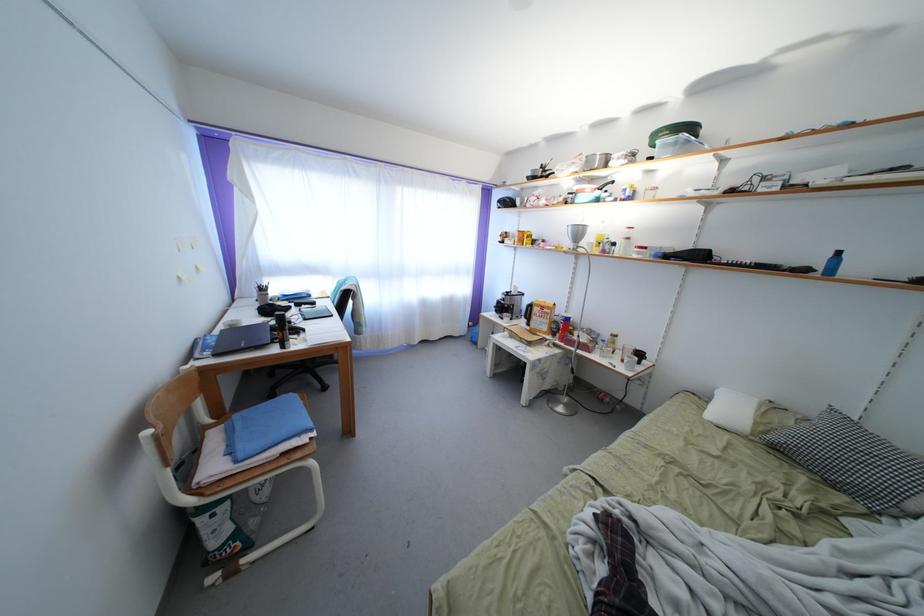
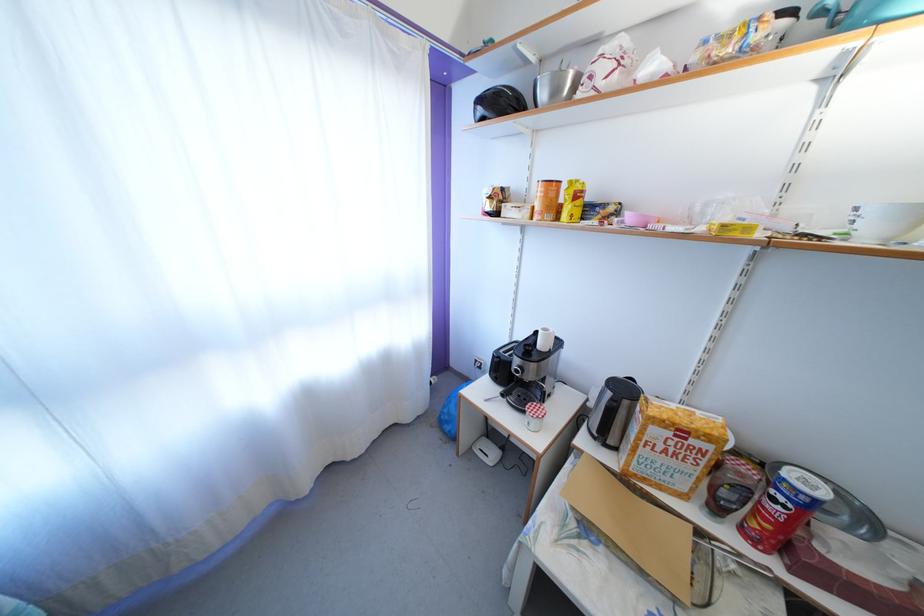
Question: In a continuous first-person perspective shot, in which direction is the camera moving?

Choices:
 (A) Left
 (B) Right
 (C) Forward
 (D) Backward

Answer: (C)